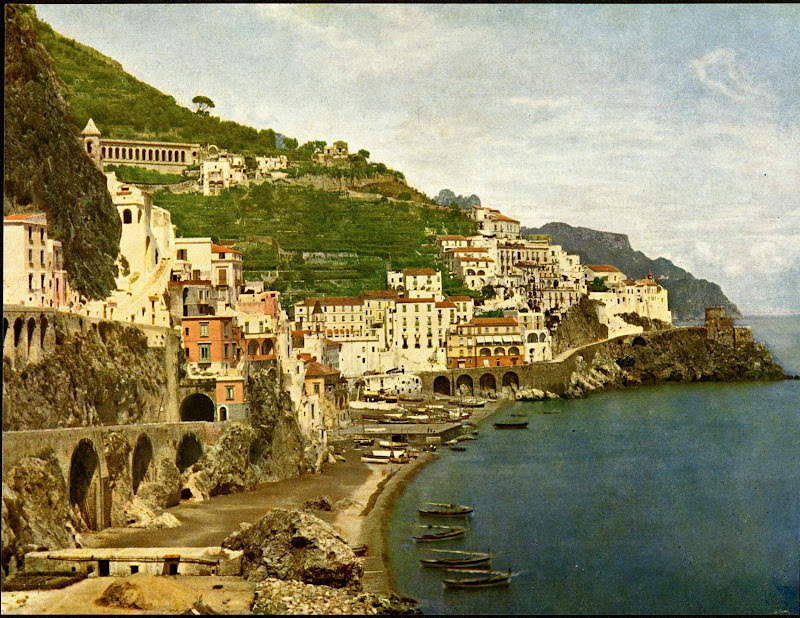
Locate an element on the screen. The height and width of the screenshot is (618, 800). window is located at coordinates (205, 355), (418, 323).